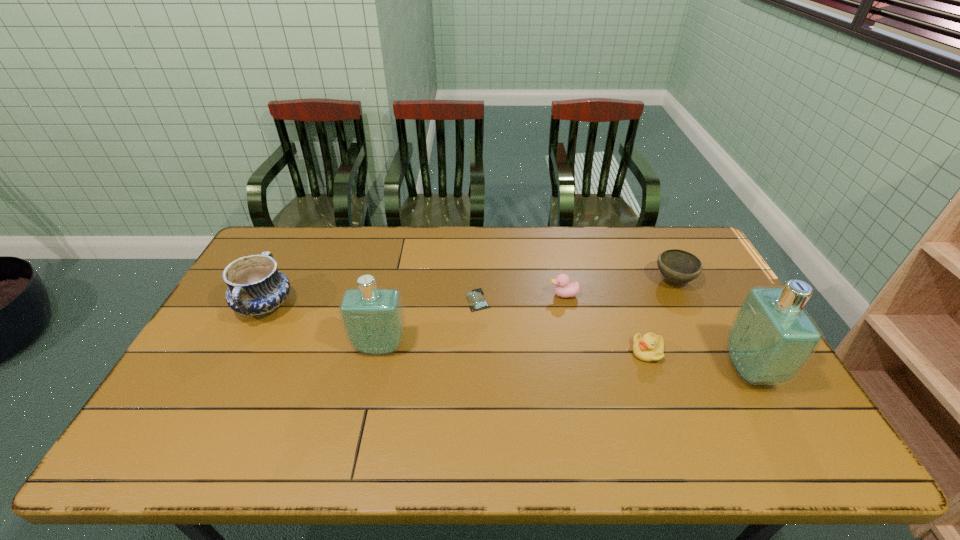
Identify the location of the farther duckling. The height and width of the screenshot is (540, 960). (564, 289).

Find the location of a particular element. The width and height of the screenshot is (960, 540). the fifth object from left to right is located at coordinates (650, 347).

At what (x,y) coordinates should I click in order to perform the action: click on the right duckling. Please return your answer as a coordinate pair (x, y). This screenshot has width=960, height=540. Looking at the image, I should click on (650, 347).

Where is `free region located on the front label of the second tallest object`? free region located on the front label of the second tallest object is located at coordinates (365, 414).

Identify the location of vacant space located on the front label of the tallest object. This screenshot has width=960, height=540. (614, 369).

This screenshot has height=540, width=960. I want to click on vacant position located on the front label of the tallest object, so click(x=636, y=369).

Find the location of `free space located 0.110m on the front label of the tallest object`. free space located 0.110m on the front label of the tallest object is located at coordinates (688, 369).

The width and height of the screenshot is (960, 540). What are the coordinates of `vacant space located on the front of the fifth shortest object` in the screenshot? It's located at (209, 414).

At what (x,y) coordinates should I click in order to perform the action: click on vacant space located 0.120m on the back of the fifth object from right to left. Please return your answer as a coordinate pair (x, y). Looking at the image, I should click on (478, 265).

The image size is (960, 540). What are the coordinates of `free space located 0.200m on the back of the bowl` in the screenshot? It's located at (650, 233).